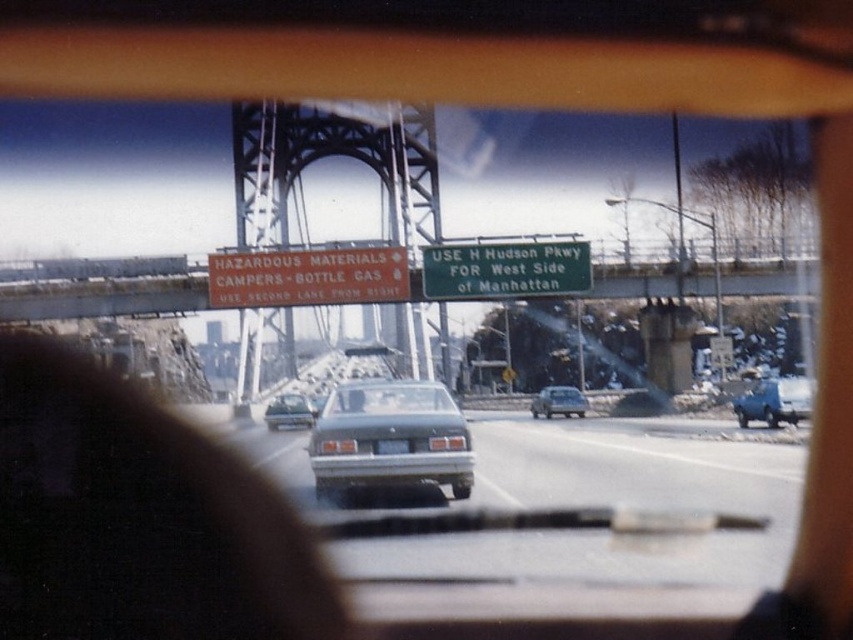
Can you confirm if blue matte van at right is bigger than black plastic license plate at center?

Correct, blue matte van at right is larger in size than black plastic license plate at center.

Can you confirm if blue matte van at right is thinner than black plastic license plate at center?

No, blue matte van at right is not thinner than black plastic license plate at center.

Locate an element on the screen. Image resolution: width=853 pixels, height=640 pixels. blue matte van at right is located at coordinates (775, 401).

Based on the photo, who is lower down, green matte sign at center or satin silver sedan at center?

satin silver sedan at center

Consider the image. Does green matte sign at center appear on the right side of satin silver sedan at center?

Yes, green matte sign at center is to the right of satin silver sedan at center.

Where is `green matte sign at center`? The width and height of the screenshot is (853, 640). green matte sign at center is located at coordinates (505, 269).

At what (x,y) coordinates should I click in order to perform the action: click on green matte sign at center. Please return your answer as a coordinate pair (x, y). The image size is (853, 640). Looking at the image, I should click on (505, 269).

Does metallic gray bridge at center-left have a lesser height compared to matte gray sedan at center?

No, metallic gray bridge at center-left is not shorter than matte gray sedan at center.

Who is more distant from viewer, (276, 353) or (544, 412)?

The point (276, 353) is more distant.

Between point (265, 333) and point (564, 396), which one is positioned behind?

Point (265, 333)

You are a GUI agent. You are given a task and a screenshot of the screen. Output one action in this format:
    pyautogui.click(x=<x>, y=<y>)
    Task: Click on the metallic gray bridge at center-left
    The image size is (853, 640).
    Given the screenshot: What is the action you would take?
    pyautogui.click(x=262, y=172)